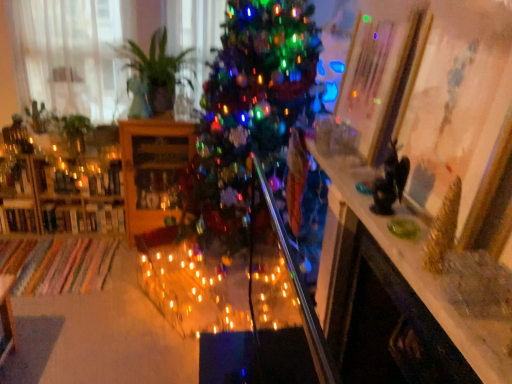
Image resolution: width=512 pixels, height=384 pixels. What do you see at coordinates (424, 279) in the screenshot? I see `shiny metallic table at upper right` at bounding box center [424, 279].

Find the location of a particular element. This screenshot has height=384, width=512. shiny metallic table at upper right is located at coordinates (424, 279).

What are the coordinates of `green glossy plant at upper left` in the screenshot? It's located at tap(153, 75).

Measure the distance between point (84, 125) and camera.

Point (84, 125) and camera are 2.92 meters apart.

Describe the element at coordinates (73, 132) in the screenshot. Image resolution: width=512 pixels, height=384 pixels. I see `green leafy plant at left` at that location.

The image size is (512, 384). Identify the location of shiny green christmas tree at center. (248, 112).

This screenshot has height=384, width=512. What are the coordinates of `wooden bookshelf at left, which appears as the 2th shelf when viewed from the right` in the screenshot? It's located at (62, 200).

Does shiny green christmas tree at center come behind white sheer curtain at left?

No, the depth of shiny green christmas tree at center is less than that of white sheer curtain at left.

Is shiny green christmas tree at center directly adjacent to white sheer curtain at left?

No, shiny green christmas tree at center is not making contact with white sheer curtain at left.

Is shiny green christmas tree at center turned away from white sheer curtain at left?

shiny green christmas tree at center is not turned away from white sheer curtain at left.

Considering the sizes of objects shiny green christmas tree at center and white sheer curtain at left in the image provided, who is taller, shiny green christmas tree at center or white sheer curtain at left?

With more height is shiny green christmas tree at center.

From the image's perspective, is white sheer curtain at left above or below wooden bookshelf at left, which appears as the 2th shelf when viewed from the right?

Based on their image positions, white sheer curtain at left is located above wooden bookshelf at left, which appears as the 2th shelf when viewed from the right.

Between white sheer curtain at left and wooden bookshelf at left, arranged as the first shelf when viewed from the left, which one is positioned behind?

Positioned behind is wooden bookshelf at left, arranged as the first shelf when viewed from the left.

Could wooden bookshelf at left, which appears as the 2th shelf when viewed from the right, be considered to be inside white sheer curtain at left?

No.

Are white sheer curtain at left and wooden bookshelf at left, arranged as the first shelf when viewed from the left, beside each other?

They are not placed beside each other.

From a real-world perspective, who is located lower, green glossy plant at upper left or shiny metallic table at upper right?

shiny metallic table at upper right is physically lower.

Does green glossy plant at upper left have a greater width compared to shiny metallic table at upper right?

Correct, the width of green glossy plant at upper left exceeds that of shiny metallic table at upper right.

Is green glossy plant at upper left placed right next to shiny metallic table at upper right?

No, green glossy plant at upper left is not beside shiny metallic table at upper right.

In the scene shown: Considering the sizes of objects green leafy plant at left and shiny metallic table at upper right in the image provided, who is shorter, green leafy plant at left or shiny metallic table at upper right?

shiny metallic table at upper right.

Looking at this image, between green leafy plant at left and shiny metallic table at upper right, which one appears on the right side from the viewer's perspective?

shiny metallic table at upper right is more to the right.

Which is behind, green leafy plant at left or shiny metallic table at upper right?

green leafy plant at left is further away from the camera.

From the picture: Between green leafy plant at left and shiny metallic table at upper right, which one has smaller size?

Smaller between the two is green leafy plant at left.

Between point (57, 202) and point (269, 93), which one is positioned in front?

The point (269, 93) is more forward.

Between wooden bookshelf at left, arranged as the first shelf when viewed from the left, and shiny green christmas tree at center, which one has smaller width?

wooden bookshelf at left, arranged as the first shelf when viewed from the left.

From a real-world perspective, relative to shiny green christmas tree at center, is wooden bookshelf at left, which appears as the 2th shelf when viewed from the right, vertically above or below?

From a real-world perspective, wooden bookshelf at left, which appears as the 2th shelf when viewed from the right, is physically below shiny green christmas tree at center.

What's the angular difference between wooden bookshelf at left, arranged as the first shelf when viewed from the left, and shiny green christmas tree at center's facing directions?

The facing directions of wooden bookshelf at left, arranged as the first shelf when viewed from the left, and shiny green christmas tree at center are 88.7 degrees apart.

Is shiny metallic table at upper right to the left of green leafy plant at left from the viewer's perspective?

No.

Are shiny metallic table at upper right and green leafy plant at left beside each other?

No, shiny metallic table at upper right is not next to green leafy plant at left.

Is shiny metallic table at upper right bigger than green leafy plant at left?

Indeed, shiny metallic table at upper right has a larger size compared to green leafy plant at left.

From the image's perspective, relative to green leafy plant at left, is shiny metallic table at upper right above or below?

shiny metallic table at upper right is situated lower than green leafy plant at left in the image.

From a real-world perspective, is green leafy plant at left beneath white sheer curtain at left?

Indeed, from a real-world perspective, green leafy plant at left is positioned beneath white sheer curtain at left.

Does point (63, 125) lie in front of point (36, 69)?

That is True.

Is green leafy plant at left aimed at white sheer curtain at left?

No, green leafy plant at left is not aimed at white sheer curtain at left.

Considering the sizes of green leafy plant at left and white sheer curtain at left in the image, is green leafy plant at left wider or thinner than white sheer curtain at left?

green leafy plant at left is wider than white sheer curtain at left.

Identify the location of christmas tree lying in front of the white sheer curtain at left. This screenshot has height=384, width=512. (248, 112).

There is a white sheer curtain at left. Where is `the 2nd shelf below it (from a real-world perspective)`? This screenshot has width=512, height=384. the 2nd shelf below it (from a real-world perspective) is located at coordinates (62, 200).

From the image, which object appears to be farther from wooden cabinet at center, the first shelf in the right-to-left sequence, green leafy plant at left or shiny green christmas tree at center?

shiny green christmas tree at center is positioned further to the anchor wooden cabinet at center, the first shelf in the right-to-left sequence.

From the image, which object appears to be farther from shiny green christmas tree at center, green leafy plant at left or wooden bookshelf at left, which appears as the 2th shelf when viewed from the right?

green leafy plant at left.

Which object lies further to the anchor point white sheer curtain at left, green leafy plant at left or wooden cabinet at center, positioned as the second shelf in left-to-right order?

Among the two, wooden cabinet at center, positioned as the second shelf in left-to-right order, is located further to white sheer curtain at left.

Considering their positions, is green glossy plant at upper left positioned further to green leafy plant at left than wooden bookshelf at left, which appears as the 2th shelf when viewed from the right?

green glossy plant at upper left is further to green leafy plant at left.

When comparing their distances from wooden bookshelf at left, arranged as the first shelf when viewed from the left, does white sheer curtain at left or shiny green christmas tree at center seem closer?

white sheer curtain at left.

From the image, which object appears to be nearer to shiny metallic table at upper right, green leafy plant at left or white sheer curtain at left?

green leafy plant at left is positioned closer to the anchor shiny metallic table at upper right.

Estimate the real-world distances between objects in this image. Which object is further from shiny green christmas tree at center, green glossy plant at upper left or wooden bookshelf at left, which appears as the 2th shelf when viewed from the right?

The object further to shiny green christmas tree at center is wooden bookshelf at left, which appears as the 2th shelf when viewed from the right.

From the image, which object appears to be nearer to green glossy plant at upper left, shiny metallic table at upper right or shiny green christmas tree at center?

The object closer to green glossy plant at upper left is shiny green christmas tree at center.

This screenshot has height=384, width=512. In order to click on window between shiny metallic table at upper right and wooden bookshelf at left, arranged as the first shelf when viewed from the left, along the z-axis in this screenshot , I will do `click(68, 56)`.

This screenshot has height=384, width=512. I want to click on plant located between white sheer curtain at left and shiny green christmas tree at center in the left-right direction, so click(x=73, y=132).

Locate an element on the screen. christmas tree positioned between shiny metallic table at upper right and wooden cabinet at center, the first shelf in the right-to-left sequence, from near to far is located at coordinates (248, 112).

At what (x,y) coordinates should I click in order to perform the action: click on houseplant between white sheer curtain at left and wooden bookshelf at left, arranged as the first shelf when viewed from the left, in the vertical direction. Please return your answer as a coordinate pair (x, y). The width and height of the screenshot is (512, 384). Looking at the image, I should click on (153, 75).